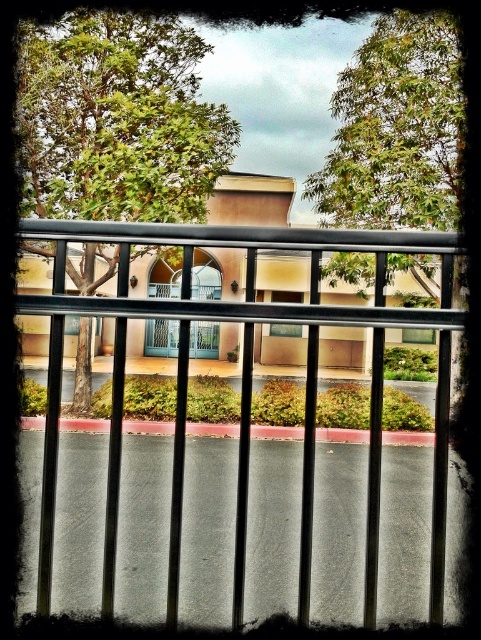
Between black metal fence at center and green leafy tree at center, which one is positioned higher?

Positioned higher is green leafy tree at center.

Describe the element at coordinates (244, 385) in the screenshot. I see `black metal fence at center` at that location.

Identify the location of black metal fence at center. Image resolution: width=481 pixels, height=640 pixels. (244, 385).

Does black metal fence at center appear over green leafy tree at upper center?

No, black metal fence at center is not above green leafy tree at upper center.

From the picture: How far apart are black metal fence at center and green leafy tree at upper center?

The distance of black metal fence at center from green leafy tree at upper center is 9.19 meters.

Who is more forward, (135,310) or (317,209)?

Point (135,310) is more forward.

The width and height of the screenshot is (481, 640). Find the location of `black metal fence at center`. black metal fence at center is located at coordinates (244, 385).

Does green leafy tree at center appear on the left side of green leafy tree at upper center?

Indeed, green leafy tree at center is positioned on the left side of green leafy tree at upper center.

Who is higher up, green leafy tree at center or green leafy tree at upper center?

green leafy tree at center

At what (x,y) coordinates should I click in order to perform the action: click on green leafy tree at center. Please return your answer as a coordinate pair (x, y). Looking at the image, I should click on (117, 120).